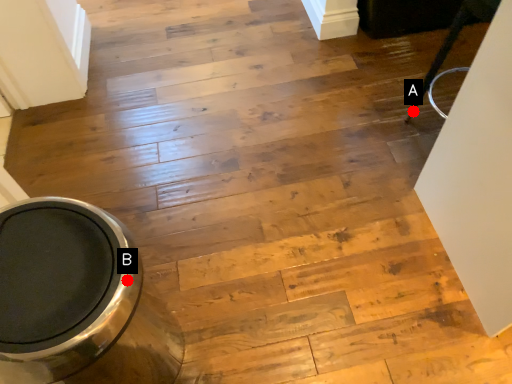
Question: Two points are circled on the image, labeled by A and B beside each circle. Among these points, which one is nearest to the camera?

Choices:
 (A) A is closer
 (B) B is closer

Answer: (B)